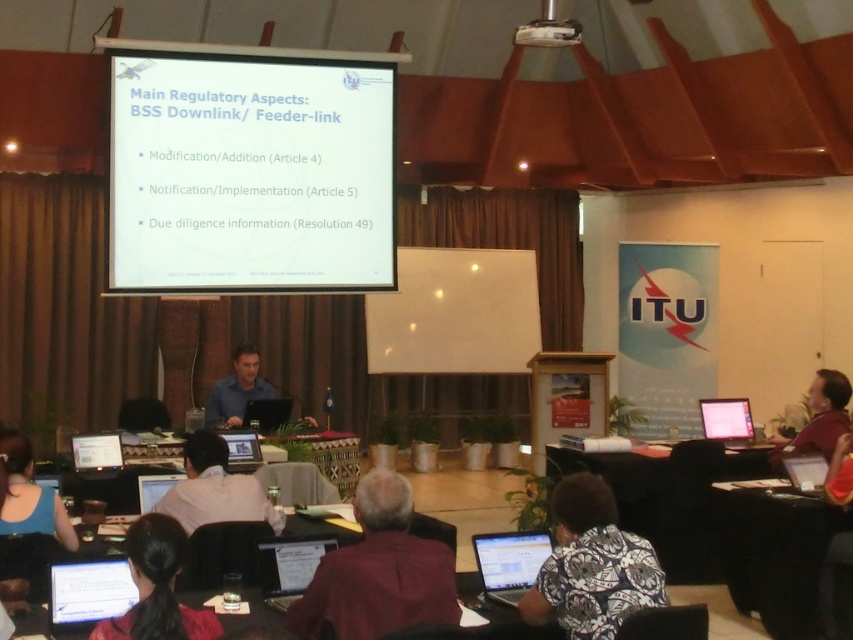
Is point (96, 598) farther from camera compared to point (718, 424)?

No, it is in front of (718, 424).

Does matte black screen at lower center have a lesser width compared to white glossy laptop at right?

Yes.

Describe the element at coordinates (90, 589) in the screenshot. Image resolution: width=853 pixels, height=640 pixels. I see `matte black screen at lower center` at that location.

What are the coordinates of `matte black screen at lower center` in the screenshot? It's located at (90, 589).

Is black hair at lower center below white paper at center?

No.

Does black hair at lower center have a smaller size compared to white paper at center?

No.

In order to click on black hair at lower center in this screenshot , I will do [157, 588].

Where is `black hair at lower center`? The height and width of the screenshot is (640, 853). black hair at lower center is located at coordinates (157, 588).

Does matte black screen at lower center have a lesser width compared to white paper at center?

In fact, matte black screen at lower center might be wider than white paper at center.

Is matte black screen at lower center positioned in front of white paper at center?

Yes, matte black screen at lower center is in front of white paper at center.

Does point (86, 564) lie behind point (289, 550)?

No, it is in front of (289, 550).

Where is `matte black screen at lower center`? Image resolution: width=853 pixels, height=640 pixels. matte black screen at lower center is located at coordinates 90,589.